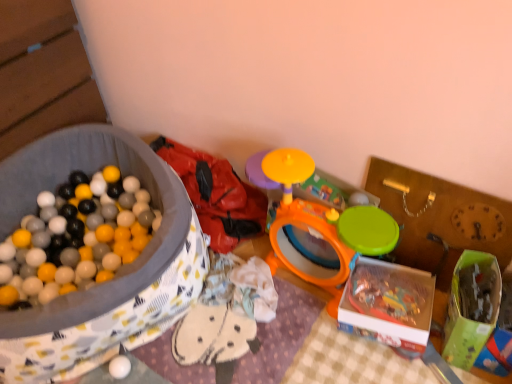
Question: Does white matte ball at lower left, the 1th toy in the left-to-right sequence, come in front of green plastic storage box at center-right, positioned as the first storage box in right-to-left order?

Choices:
 (A) no
 (B) yes

Answer: (A)

Question: Can you confirm if white matte ball at lower left, which appears as the third toy when viewed from the right, is thinner than green plastic storage box at center-right, which is the third storage box from left to right?

Choices:
 (A) yes
 (B) no

Answer: (B)

Question: Is white matte ball at lower left, the 1th toy in the left-to-right sequence, in contact with green plastic storage box at center-right, positioned as the first storage box in right-to-left order?

Choices:
 (A) yes
 (B) no

Answer: (B)

Question: From the image's perspective, would you say white matte ball at lower left, the 1th toy in the left-to-right sequence, is shown under green plastic storage box at center-right, which is the third storage box from left to right?

Choices:
 (A) yes
 (B) no

Answer: (A)

Question: Is white matte ball at lower left, which appears as the third toy when viewed from the right, outside of green plastic storage box at center-right, which is the third storage box from left to right?

Choices:
 (A) yes
 (B) no

Answer: (A)

Question: Is white matte ball at lower left, the 1th toy in the left-to-right sequence, not close to green plastic storage box at center-right, positioned as the first storage box in right-to-left order?

Choices:
 (A) yes
 (B) no

Answer: (A)

Question: Is orange plastic drum at center, marked as the 1th toy in a right-to-left arrangement, not close to matte fabric ball pit at left, the third storage box in the right-to-left sequence?

Choices:
 (A) no
 (B) yes

Answer: (A)

Question: Does orange plastic drum at center, marked as the 1th toy in a right-to-left arrangement, appear on the left side of matte fabric ball pit at left, positioned as the first storage box in left-to-right order?

Choices:
 (A) no
 (B) yes

Answer: (A)

Question: Considering the relative sizes of orange plastic drum at center, the third toy from the left, and matte fabric ball pit at left, the third storage box in the right-to-left sequence, in the image provided, is orange plastic drum at center, the third toy from the left, smaller than matte fabric ball pit at left, the third storage box in the right-to-left sequence,?

Choices:
 (A) yes
 (B) no

Answer: (A)

Question: Is orange plastic drum at center, the third toy from the left, positioned before matte fabric ball pit at left, positioned as the first storage box in left-to-right order?

Choices:
 (A) no
 (B) yes

Answer: (A)

Question: From the image's perspective, would you say orange plastic drum at center, marked as the 1th toy in a right-to-left arrangement, is shown under matte fabric ball pit at left, positioned as the first storage box in left-to-right order?

Choices:
 (A) yes
 (B) no

Answer: (B)

Question: Is orange plastic drum at center, marked as the 1th toy in a right-to-left arrangement, beside matte fabric ball pit at left, positioned as the first storage box in left-to-right order?

Choices:
 (A) no
 (B) yes

Answer: (A)

Question: From the image's perspective, is green plastic storage box at center-right, which is the third storage box from left to right, above rubberized red jacket at upper left, positioned as the second toy in right-to-left order?

Choices:
 (A) no
 (B) yes

Answer: (A)